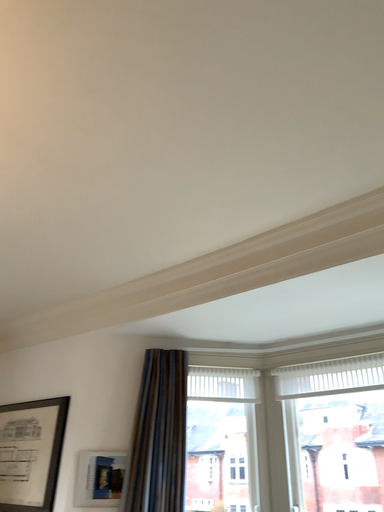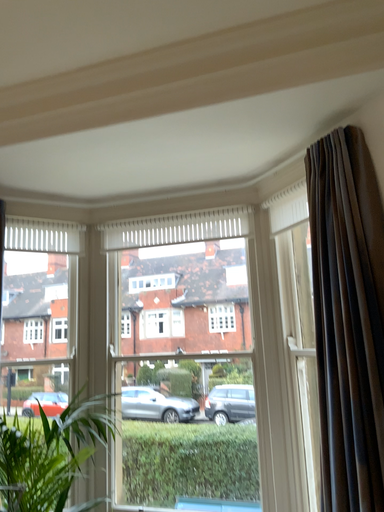
Question: How did the camera likely rotate when shooting the video?

Choices:
 (A) rotated left
 (B) rotated right

Answer: (B)